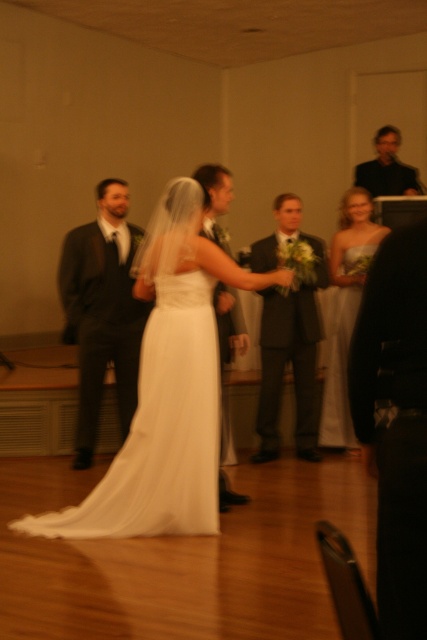
Question: Can you confirm if matte gray suit at center is bigger than matte black suit at center?

Choices:
 (A) yes
 (B) no

Answer: (A)

Question: Does white satin dress at center have a larger size compared to matte black suit at upper right?

Choices:
 (A) no
 (B) yes

Answer: (B)

Question: Which point appears closest to the camera in this image?

Choices:
 (A) (332, 307)
 (B) (216, 333)

Answer: (B)

Question: Can you confirm if matte black suit at left is positioned to the left of matte gray suit at center?

Choices:
 (A) no
 (B) yes

Answer: (B)

Question: Which object appears closest to the camera in this image?

Choices:
 (A) matte black suit at left
 (B) white satin dress at center
 (C) matte gray suit at center

Answer: (B)

Question: Which point is farther from the camera taking this photo?

Choices:
 (A) (239, 326)
 (B) (380, 160)
 (C) (123, 420)
 (D) (160, 448)

Answer: (B)